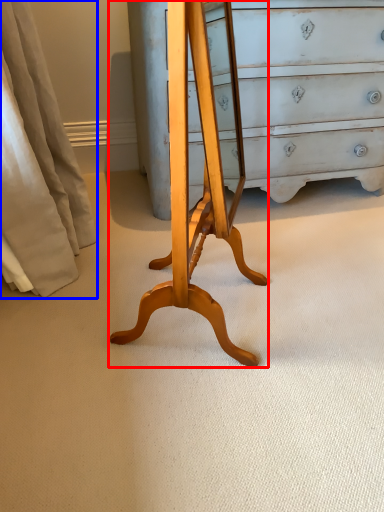
Question: Among these objects, which one is nearest to the camera, changing table (highlighted by a red box) or curtain (highlighted by a blue box)?

Choices:
 (A) changing table
 (B) curtain

Answer: (A)